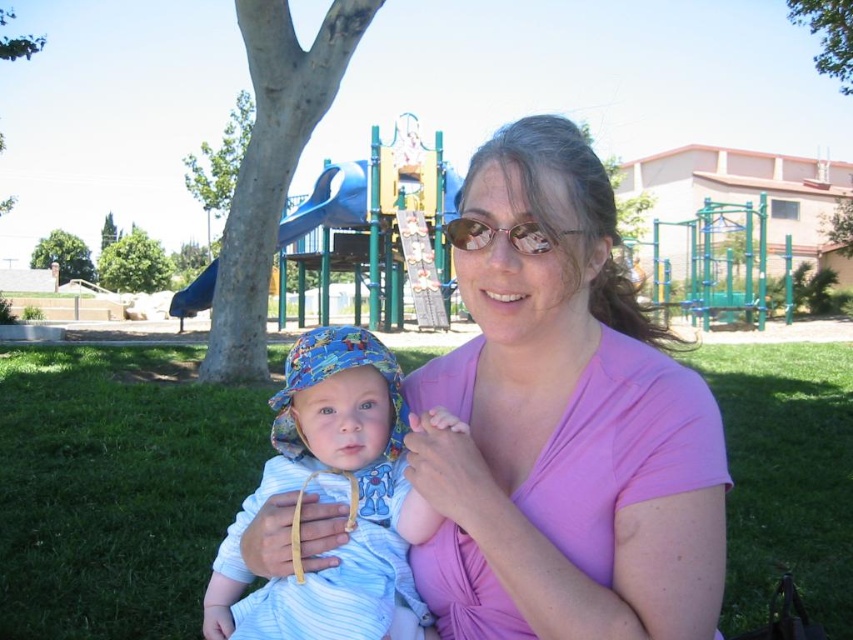
Does blue cotton hat at center have a larger size compared to glossy plastic goggles at center?

No, blue cotton hat at center is not bigger than glossy plastic goggles at center.

Is point (347, 593) positioned before point (531, 228)?

No, (347, 593) is behind (531, 228).

Does point (358, 504) come closer to viewer compared to point (466, 243)?

No, it is not.

Find the location of a particular element. The width and height of the screenshot is (853, 640). blue cotton hat at center is located at coordinates (331, 500).

Is pink cotton shirt at center wider than glossy plastic goggles at center?

Correct, the width of pink cotton shirt at center exceeds that of glossy plastic goggles at center.

Who is more distant from viewer, (552, 448) or (482, 248)?

Point (552, 448)

Identify the location of pink cotton shirt at center. This screenshot has height=640, width=853. (564, 428).

Based on the photo, can you confirm if green grass at lower center is bigger than blue cotton hat at center?

Yes, green grass at lower center is bigger than blue cotton hat at center.

Which of these two, green grass at lower center or blue cotton hat at center, stands taller?

green grass at lower center

This screenshot has width=853, height=640. Identify the location of green grass at lower center. (115, 488).